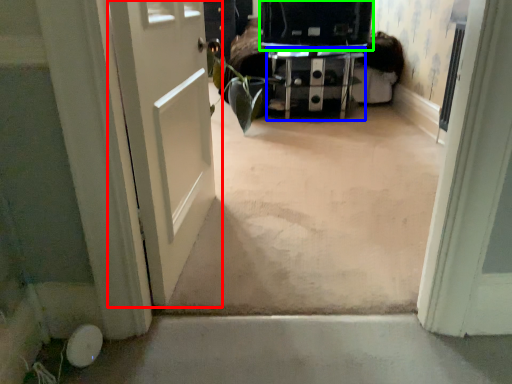
Question: Considering the real-world distances, which object is farthest from door (highlighted by a red box)? furniture (highlighted by a blue box) or back (highlighted by a green box)?

Choices:
 (A) furniture
 (B) back

Answer: (A)